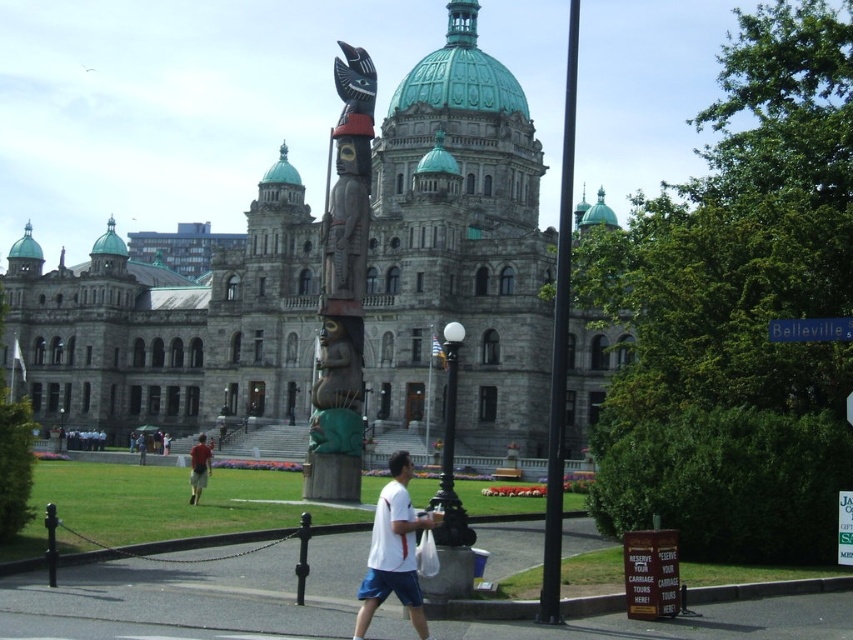
You are a visitor standing in front of the historic building. You see the smooth black pole at center and the light brown fabric pants at center. Which object is taller?

The smooth black pole at center is taller than the light brown fabric pants at center.

You are a visitor standing in front of the grand historic building. You notice the smooth black pole at center and the light brown fabric pants at center. Which object is positioned higher from the ground?

The smooth black pole at center is above the light brown fabric pants at center, so the smooth black pole at center is higher from the ground.

You are standing in front of the grand historic building and notice a point marked at coordinates (198,468). What object is located at that point?

The point at coordinates (198,468) corresponds to the light brown fabric pants at center.